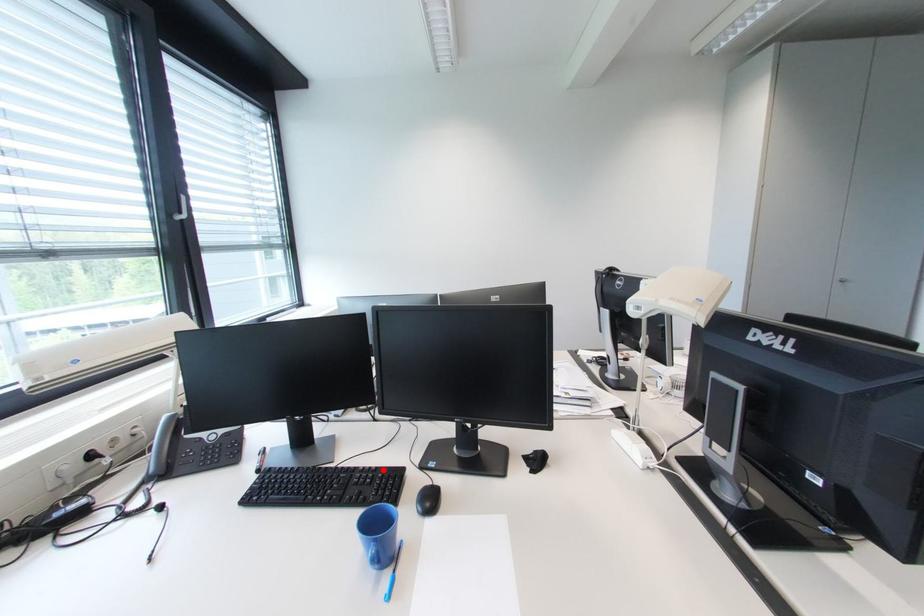
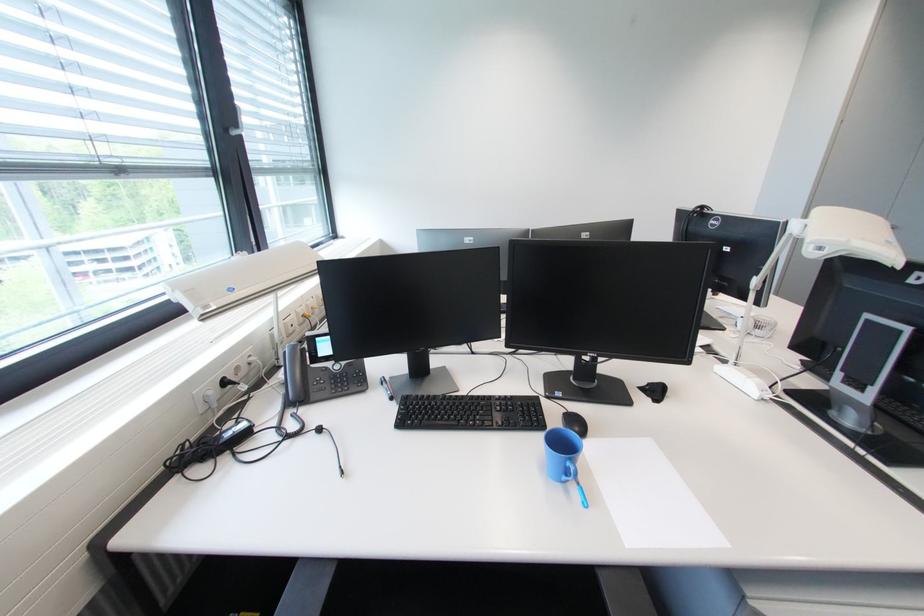
In the second image, find the point that corresponds to the highlighted location in the first image.

(517, 398)